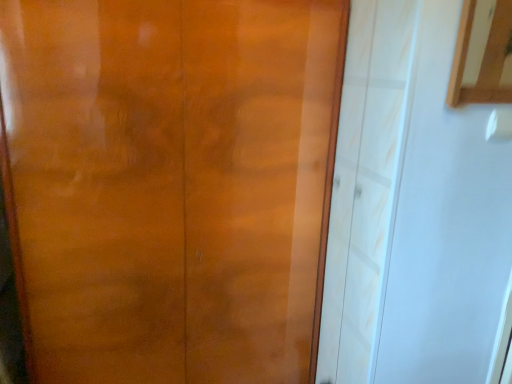
In order to face light wood cabinet at upper right, should I rotate leftwards or rightwards?

Rotate your view right by about 30.859°.

What is the approximate height of light wood cabinet at upper right?

light wood cabinet at upper right is 16.87 inches tall.

This screenshot has height=384, width=512. What do you see at coordinates (482, 54) in the screenshot?
I see `light wood cabinet at upper right` at bounding box center [482, 54].

Where is `light wood cabinet at upper right`? The image size is (512, 384). light wood cabinet at upper right is located at coordinates (482, 54).

What is the approximate width of light wood cabinet at upper right?

It is 1.54 inches.

The height and width of the screenshot is (384, 512). What are the coordinates of `matte wood door at center` in the screenshot? It's located at (170, 184).

Image resolution: width=512 pixels, height=384 pixels. What do you see at coordinates (170, 184) in the screenshot?
I see `matte wood door at center` at bounding box center [170, 184].

Locate an element on the screen. This screenshot has width=512, height=384. light wood cabinet at upper right is located at coordinates (482, 54).

Between light wood cabinet at upper right and matte wood door at center, which one appears on the right side from the viewer's perspective?

light wood cabinet at upper right is more to the right.

Between light wood cabinet at upper right and matte wood door at center, which one is positioned behind?

matte wood door at center is more distant.

Considering the positions of points (508, 66) and (175, 376), is point (508, 66) farther from camera compared to point (175, 376)?

Yes, point (508, 66) is behind point (175, 376).

From the image's perspective, does light wood cabinet at upper right appear lower than matte wood door at center?

No, from the image's perspective, light wood cabinet at upper right is not below matte wood door at center.

From a real-world perspective, is light wood cabinet at upper right over matte wood door at center?

Yes, from a real-world perspective, light wood cabinet at upper right is above matte wood door at center.

Is light wood cabinet at upper right thinner than matte wood door at center?

Indeed, light wood cabinet at upper right has a lesser width compared to matte wood door at center.

Between light wood cabinet at upper right and matte wood door at center, which one has less height?

Standing shorter between the two is light wood cabinet at upper right.

Based on the photo, is light wood cabinet at upper right smaller than matte wood door at center?

Yes.

Is light wood cabinet at upper right outside of matte wood door at center?

light wood cabinet at upper right is positioned outside matte wood door at center.

Can you see light wood cabinet at upper right touching matte wood door at center?

They are not placed beside each other.

Is light wood cabinet at upper right oriented towards matte wood door at center?

No, light wood cabinet at upper right is not turned towards matte wood door at center.

What's the angular difference between light wood cabinet at upper right and matte wood door at center's facing directions?

The facing directions of light wood cabinet at upper right and matte wood door at center are 1.79 degrees apart.

Measure the distance between light wood cabinet at upper right and matte wood door at center.

light wood cabinet at upper right is 5.98 feet away from matte wood door at center.

Where is `cabinetry that is in front of the matte wood door at center`? cabinetry that is in front of the matte wood door at center is located at coordinates (482, 54).

Considering the positions of objects matte wood door at center and light wood cabinet at upper right in the image provided, who is more to the left, matte wood door at center or light wood cabinet at upper right?

matte wood door at center is more to the left.

Relative to light wood cabinet at upper right, is matte wood door at center in front or behind?

In the image, matte wood door at center appears behind light wood cabinet at upper right.

Is point (34, 75) closer or farther from the camera than point (483, 60)?

Point (34, 75) is positioned closer to the camera compared to point (483, 60).

From the image's perspective, is matte wood door at center beneath light wood cabinet at upper right?

Indeed, from the image's perspective, matte wood door at center is shown beneath light wood cabinet at upper right.

From a real-world perspective, which is physically below, matte wood door at center or light wood cabinet at upper right?

From a 3D spatial view, matte wood door at center is below.

Considering the sizes of matte wood door at center and light wood cabinet at upper right in the image, is matte wood door at center wider or thinner than light wood cabinet at upper right?

Considering their sizes, matte wood door at center looks broader than light wood cabinet at upper right.

Between matte wood door at center and light wood cabinet at upper right, which one has less height?

With less height is light wood cabinet at upper right.

Between matte wood door at center and light wood cabinet at upper right, which one has larger size?

matte wood door at center.

Can we say matte wood door at center lies outside light wood cabinet at upper right?

Yes, matte wood door at center is not within light wood cabinet at upper right.

Can you see matte wood door at center touching light wood cabinet at upper right?

matte wood door at center is not next to light wood cabinet at upper right, and they're not touching.

Is matte wood door at center oriented towards light wood cabinet at upper right?

No, matte wood door at center is not aimed at light wood cabinet at upper right.

This screenshot has height=384, width=512. Identify the location of door located behind the light wood cabinet at upper right. (170, 184).

Identify the location of cabinetry that appears on the right of matte wood door at center. (482, 54).

The width and height of the screenshot is (512, 384). What are the coordinates of `door below the light wood cabinet at upper right (from the image's perspective)` in the screenshot? It's located at (170, 184).